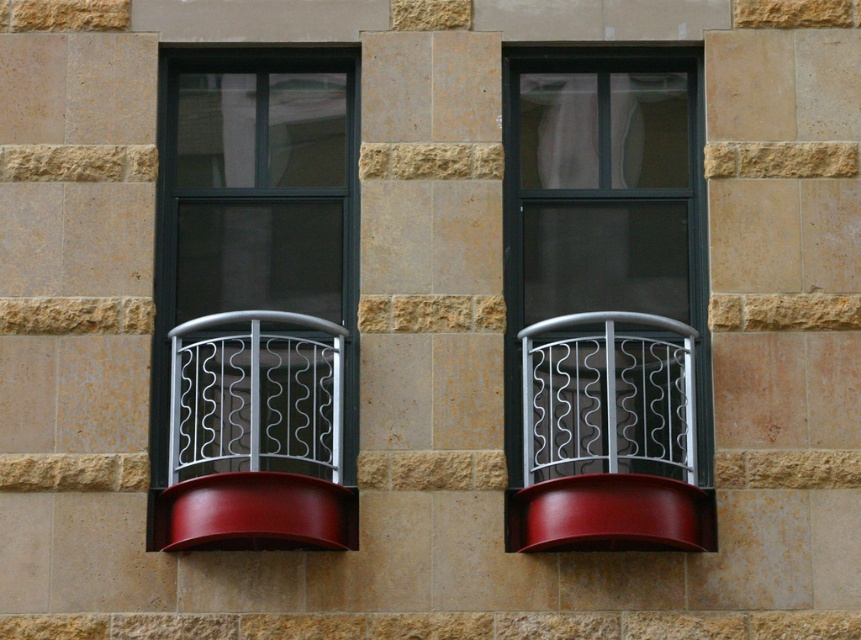
Question: Is the position of metallic silver balcony at left less distant than that of glossy wood window sill at center?

Choices:
 (A) no
 (B) yes

Answer: (A)

Question: Does metallic silver railing at center have a smaller size compared to white metal rail at left?

Choices:
 (A) no
 (B) yes

Answer: (A)

Question: Which of these objects is positioned farthest from the metallic silver balcony at left?

Choices:
 (A) glossy wood window sill at center
 (B) white metal rail at left
 (C) glossy wood window sill at lower left
 (D) white sheer curtain at upper right

Answer: (A)

Question: Among these points, which one is farthest from the camera?

Choices:
 (A) (224, 410)
 (B) (635, 92)
 (C) (534, 525)

Answer: (B)

Question: Which object is the closest to the matte black window at center?

Choices:
 (A) glossy wood window sill at center
 (B) glossy wood window sill at lower left
 (C) metallic silver balcony at left
 (D) white metal rail at left

Answer: (C)

Question: Can you confirm if metallic silver balcony at left is positioned to the right of metallic silver railing at center?

Choices:
 (A) no
 (B) yes

Answer: (A)